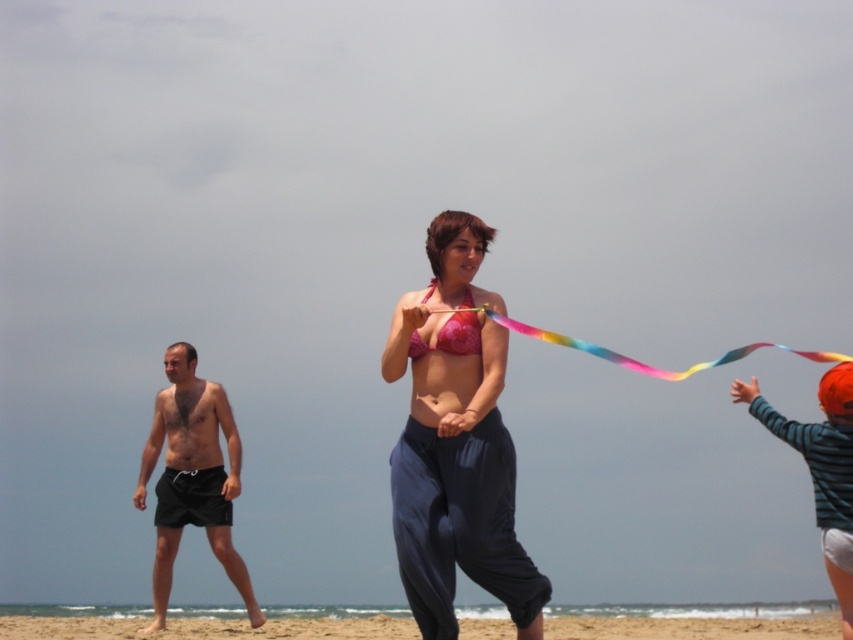
Between point (827, 556) and point (849, 356), which one is positioned behind?

The point (849, 356) is more distant.

This screenshot has height=640, width=853. Find the location of `striped cotton shirt at right`. striped cotton shirt at right is located at coordinates (821, 468).

Which is more to the right, sandy beach at lower center or rainbow fabric ribbon at center?

rainbow fabric ribbon at center is more to the right.

In order to click on sandy beach at lower center in this screenshot , I will do `click(207, 628)`.

Does pink fabric bikini top at center lie in front of striped cotton shirt at right?

Yes, pink fabric bikini top at center is closer to the viewer.

Can you confirm if pink fabric bikini top at center is positioned to the left of striped cotton shirt at right?

Indeed, pink fabric bikini top at center is positioned on the left side of striped cotton shirt at right.

What do you see at coordinates (456, 442) in the screenshot? I see `pink fabric bikini top at center` at bounding box center [456, 442].

This screenshot has width=853, height=640. In order to click on pink fabric bikini top at center in this screenshot , I will do `click(456, 442)`.